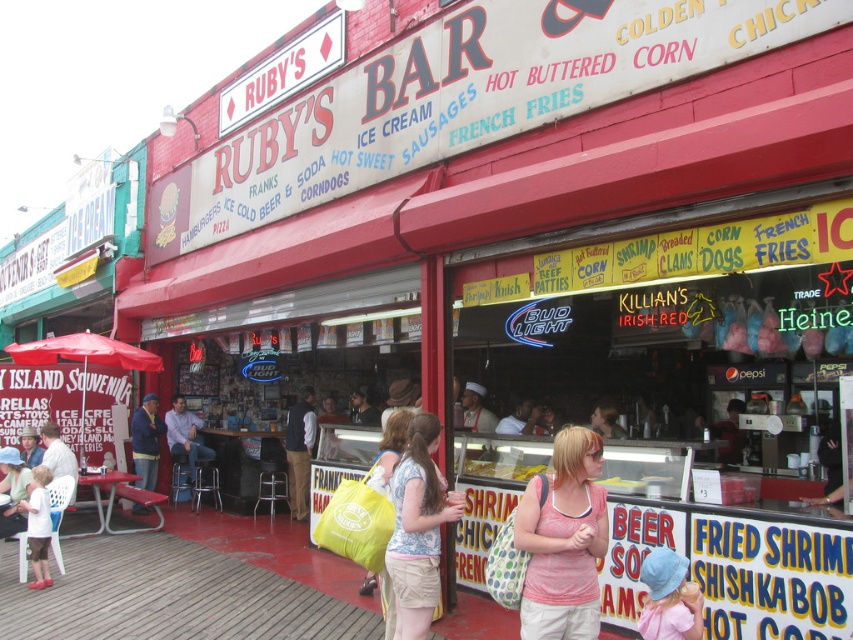
Question: Estimate the real-world distances between objects in this image. Which object is closer to the pink cotton tank top at center?

Choices:
 (A) blue denim jacket at lower left
 (B) light blue denim shorts at center
 (C) golden fried shrimp at center
 (D) light purple shirt at center

Answer: (B)

Question: Which is farther from the yellow fabric bag at center?

Choices:
 (A) pink cotton tank top at center
 (B) light purple shirt at center
 (C) light blue denim shorts at center

Answer: (B)

Question: Does dark blue jeans at center have a lesser width compared to golden fried shrimp at center?

Choices:
 (A) no
 (B) yes

Answer: (B)

Question: Does dark blue jeans at center have a greater width compared to blue denim jacket at lower left?

Choices:
 (A) yes
 (B) no

Answer: (A)

Question: Estimate the real-world distances between objects in this image. Which object is farther from the blue denim jacket at lower left?

Choices:
 (A) golden fried shrimp at center
 (B) light purple shirt at center
 (C) yellow fabric bag at center

Answer: (C)

Question: Does dark blue jeans at center have a smaller size compared to light purple shirt at center?

Choices:
 (A) no
 (B) yes

Answer: (B)